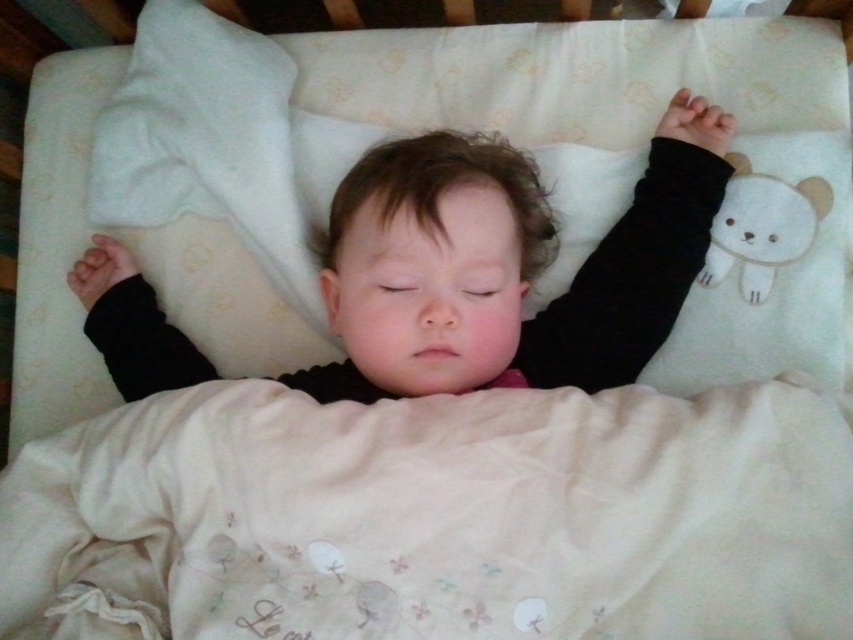
Question: In this image, where is smooth skin baby at center located relative to white plush bear at upper right?

Choices:
 (A) left
 (B) right

Answer: (A)

Question: Which point appears closest to the camera in this image?

Choices:
 (A) click(x=677, y=588)
 (B) click(x=112, y=308)

Answer: (A)

Question: Does smooth skin baby at center have a larger size compared to white plush bear at upper right?

Choices:
 (A) no
 (B) yes

Answer: (B)

Question: Among these objects, which one is nearest to the camera?

Choices:
 (A) smooth skin baby at center
 (B) soft cream fabric at center

Answer: (B)

Question: Which object is closer to the camera taking this photo?

Choices:
 (A) white plush bear at upper right
 (B) smooth skin baby at center

Answer: (B)

Question: Is smooth skin baby at center to the right of white plush bear at upper right from the viewer's perspective?

Choices:
 (A) yes
 (B) no

Answer: (B)